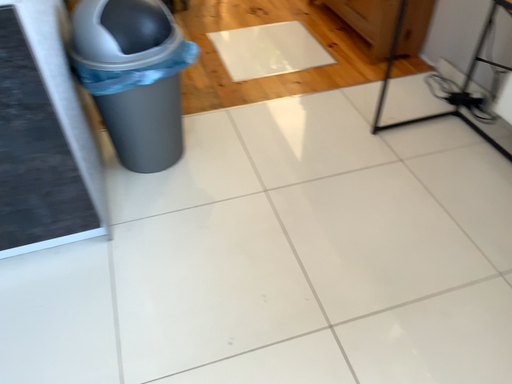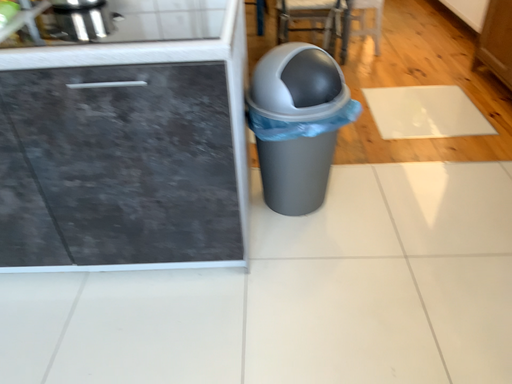
Question: Which way did the camera rotate in the video?

Choices:
 (A) rotated right
 (B) rotated left

Answer: (B)